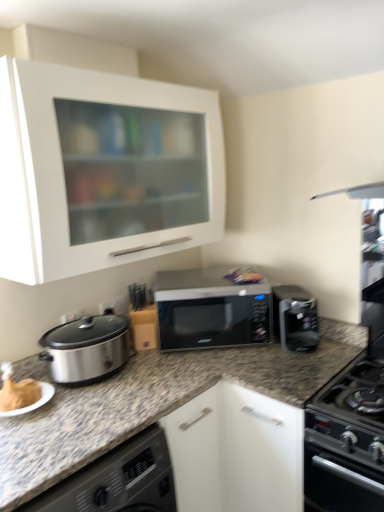
Question: Is black matte oven at lower right smaller than white matte cabinet at upper left?

Choices:
 (A) yes
 (B) no

Answer: (A)

Question: Is black matte oven at lower right wider than white matte cabinet at upper left?

Choices:
 (A) yes
 (B) no

Answer: (A)

Question: Is black matte oven at lower right at the right side of white matte cabinet at upper left?

Choices:
 (A) yes
 (B) no

Answer: (A)

Question: Considering the relative sizes of black matte oven at lower right and white matte cabinet at upper left in the image provided, is black matte oven at lower right bigger than white matte cabinet at upper left?

Choices:
 (A) no
 (B) yes

Answer: (A)

Question: Is black matte oven at lower right located outside white matte cabinet at upper left?

Choices:
 (A) no
 (B) yes

Answer: (B)

Question: Is black matte oven at lower right in front of white matte cabinet at upper left?

Choices:
 (A) yes
 (B) no

Answer: (A)

Question: Is sleek black microwave at center at the right side of satin black coffee maker at right?

Choices:
 (A) no
 (B) yes

Answer: (A)

Question: Is the position of sleek black microwave at center more distant than that of satin black coffee maker at right?

Choices:
 (A) yes
 (B) no

Answer: (A)

Question: Would you say sleek black microwave at center is outside satin black coffee maker at right?

Choices:
 (A) no
 (B) yes

Answer: (B)

Question: Is sleek black microwave at center surrounding satin black coffee maker at right?

Choices:
 (A) yes
 (B) no

Answer: (B)

Question: Is the position of sleek black microwave at center less distant than that of satin black coffee maker at right?

Choices:
 (A) no
 (B) yes

Answer: (A)

Question: From the image's perspective, is sleek black microwave at center on top of satin black coffee maker at right?

Choices:
 (A) yes
 (B) no

Answer: (A)

Question: Considering the relative sizes of sleek black microwave at center and white matte cabinet at upper left in the image provided, is sleek black microwave at center thinner than white matte cabinet at upper left?

Choices:
 (A) yes
 (B) no

Answer: (B)